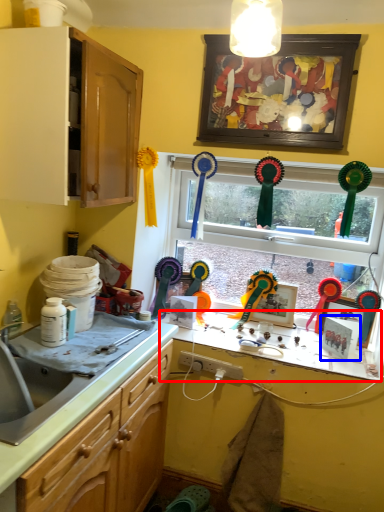
Question: Which object appears farthest to the camera in this image, counter top (highlighted by a red box) or picture frame (highlighted by a blue box)?

Choices:
 (A) counter top
 (B) picture frame

Answer: (B)